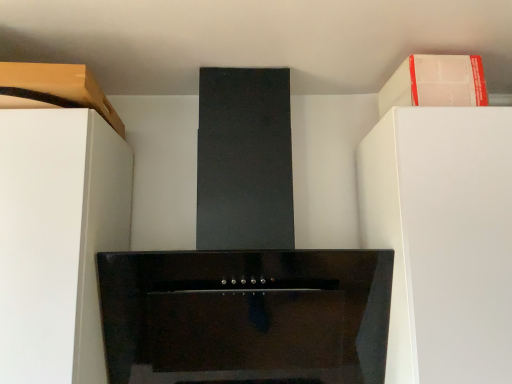
Question: Are white matte cabinet at upper right, the 2th cabinetry when ordered from left to right, and matte wood cabinet at upper left, which is counted as the first cabinetry, starting from the left, located far from each other?

Choices:
 (A) no
 (B) yes

Answer: (A)

Question: Is white matte cabinet at upper right, acting as the first cabinetry starting from the right, oriented towards matte wood cabinet at upper left, which is counted as the first cabinetry, starting from the left?

Choices:
 (A) no
 (B) yes

Answer: (A)

Question: From the image's perspective, is white matte cabinet at upper right, the 2th cabinetry when ordered from left to right, located beneath matte wood cabinet at upper left, which is counted as the first cabinetry, starting from the left?

Choices:
 (A) yes
 (B) no

Answer: (B)

Question: Is white matte cabinet at upper right, the 2th cabinetry when ordered from left to right, positioned behind matte wood cabinet at upper left, placed as the 2th cabinetry when sorted from right to left?

Choices:
 (A) yes
 (B) no

Answer: (A)

Question: Does white matte cabinet at upper right, acting as the first cabinetry starting from the right, have a larger size compared to matte wood cabinet at upper left, which is counted as the first cabinetry, starting from the left?

Choices:
 (A) no
 (B) yes

Answer: (A)

Question: Is the depth of white matte cabinet at upper right, the 2th cabinetry when ordered from left to right, less than that of matte wood cabinet at upper left, placed as the 2th cabinetry when sorted from right to left?

Choices:
 (A) no
 (B) yes

Answer: (A)

Question: Is matte wood cabinet at upper left, which is counted as the first cabinetry, starting from the left, in contact with white matte cabinet at upper right, the 2th cabinetry when ordered from left to right?

Choices:
 (A) yes
 (B) no

Answer: (B)

Question: Could you tell me if matte wood cabinet at upper left, which is counted as the first cabinetry, starting from the left, is turned towards white matte cabinet at upper right, acting as the first cabinetry starting from the right?

Choices:
 (A) yes
 (B) no

Answer: (B)

Question: Would you consider matte wood cabinet at upper left, which is counted as the first cabinetry, starting from the left, to be distant from white matte cabinet at upper right, acting as the first cabinetry starting from the right?

Choices:
 (A) no
 (B) yes

Answer: (A)

Question: Does matte wood cabinet at upper left, placed as the 2th cabinetry when sorted from right to left, have a greater height compared to white matte cabinet at upper right, acting as the first cabinetry starting from the right?

Choices:
 (A) yes
 (B) no

Answer: (B)

Question: From a real-world perspective, is matte wood cabinet at upper left, placed as the 2th cabinetry when sorted from right to left, on white matte cabinet at upper right, acting as the first cabinetry starting from the right?

Choices:
 (A) no
 (B) yes

Answer: (A)

Question: Is matte wood cabinet at upper left, placed as the 2th cabinetry when sorted from right to left, not within white matte cabinet at upper right, the 2th cabinetry when ordered from left to right?

Choices:
 (A) no
 (B) yes

Answer: (B)

Question: Is white matte cabinet at upper right, acting as the first cabinetry starting from the right, positioned with its back to white matte cabinet at left?

Choices:
 (A) yes
 (B) no

Answer: (B)